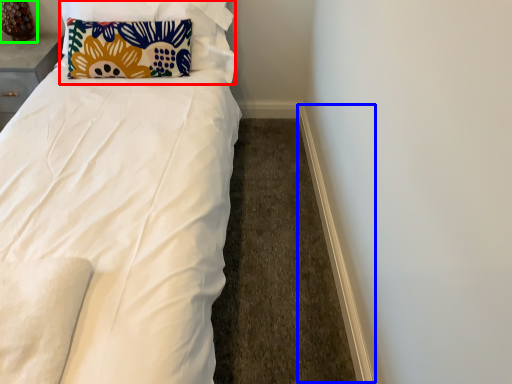
Question: Based on their relative distances, which object is farther from pillow (highlighted by a red box)? Choose from trim (highlighted by a blue box) and table lamp (highlighted by a green box).

Choices:
 (A) trim
 (B) table lamp

Answer: (A)